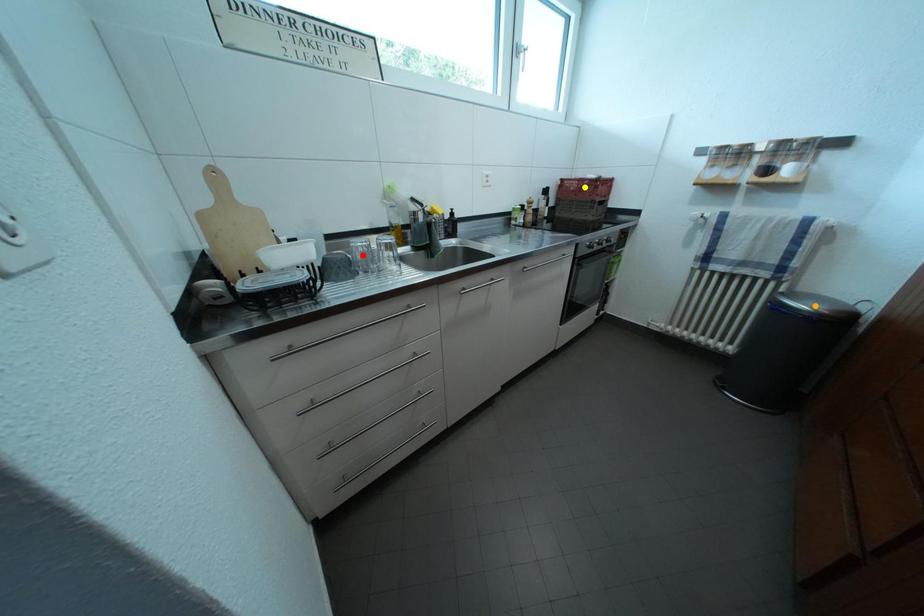
Order these from nearest to farthest:
orange point | red point | yellow point

yellow point < orange point < red point